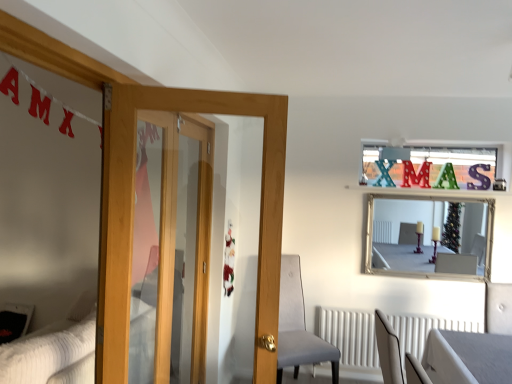
Question: Does white textured radiator at lower center have a lesser height compared to silver/glass mirror at upper center?

Choices:
 (A) yes
 (B) no

Answer: (A)

Question: Considering the relative sizes of white textured radiator at lower center and silver/glass mirror at upper center in the image provided, is white textured radiator at lower center smaller than silver/glass mirror at upper center?

Choices:
 (A) no
 (B) yes

Answer: (B)

Question: Does white textured radiator at lower center have a greater width compared to silver/glass mirror at upper center?

Choices:
 (A) yes
 (B) no

Answer: (B)

Question: Considering the relative sizes of white textured radiator at lower center and silver/glass mirror at upper center in the image provided, is white textured radiator at lower center taller than silver/glass mirror at upper center?

Choices:
 (A) yes
 (B) no

Answer: (B)

Question: Is white textured radiator at lower center with silver/glass mirror at upper center?

Choices:
 (A) no
 (B) yes

Answer: (A)

Question: Is velvet grey chair at center inside or outside of white textured radiator at lower center?

Choices:
 (A) inside
 (B) outside

Answer: (B)

Question: Relative to white textured radiator at lower center, is velvet grey chair at center in front or behind?

Choices:
 (A) front
 (B) behind

Answer: (A)

Question: Is velvet grey chair at center to the left or to the right of white textured radiator at lower center in the image?

Choices:
 (A) right
 (B) left

Answer: (B)

Question: In terms of width, does velvet grey chair at center look wider or thinner when compared to white textured radiator at lower center?

Choices:
 (A) wide
 (B) thin

Answer: (A)

Question: Is metallic silver letter at upper right, the 2th letter viewed from the left, bigger or smaller than white textured bed at lower left?

Choices:
 (A) big
 (B) small

Answer: (B)

Question: Would you say metallic silver letter at upper right, which appears as the 1th letter when viewed from the right, is to the left or to the right of white textured bed at lower left in the picture?

Choices:
 (A) right
 (B) left

Answer: (A)

Question: From the image's perspective, is metallic silver letter at upper right, which appears as the 1th letter when viewed from the right, located above or below white textured bed at lower left?

Choices:
 (A) below
 (B) above

Answer: (B)

Question: Does point (483, 175) appear closer or farther from the camera than point (40, 339)?

Choices:
 (A) closer
 (B) farther

Answer: (B)

Question: Does point (271, 364) appear closer or farther from the camera than point (488, 165)?

Choices:
 (A) closer
 (B) farther

Answer: (A)

Question: In the image, is wooden door at left positioned in front of or behind metallic silver letter at upper right, the 2th letter viewed from the left?

Choices:
 (A) behind
 (B) front

Answer: (B)